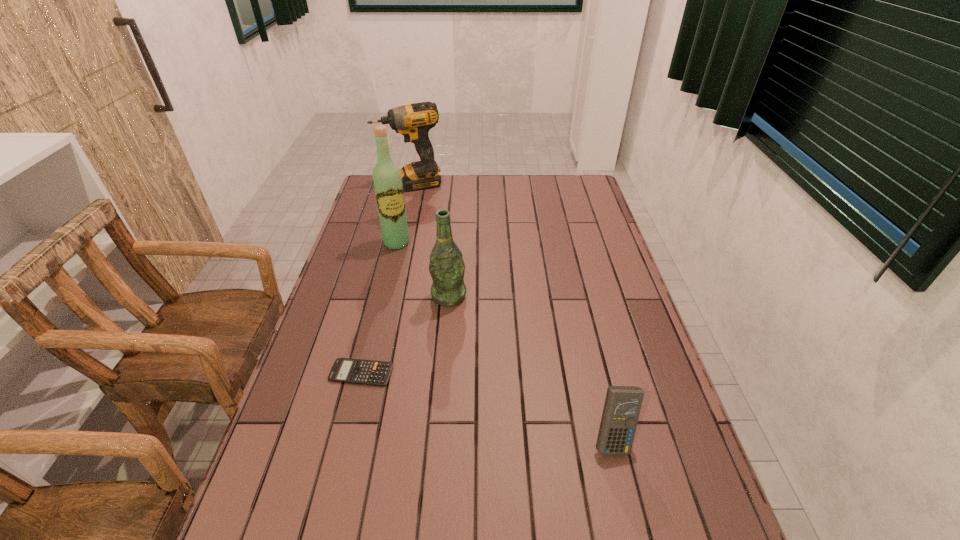
Image resolution: width=960 pixels, height=540 pixels. I want to click on free space on the desktop that is between the shortest object and the fourth tallest object and is positioned on the surface of the fourth object from left to right, so click(x=445, y=395).

Identify the location of vacant space on the desktop that is between the farther calculator and the taller calculator and is positioned on the front-facing side of the wine bottle. The height and width of the screenshot is (540, 960). (461, 399).

I want to click on vacant spot on the desktop that is between the fourth farthest object and the taller calculator and is positioned with the drill bit of the drill facing forward, so click(501, 410).